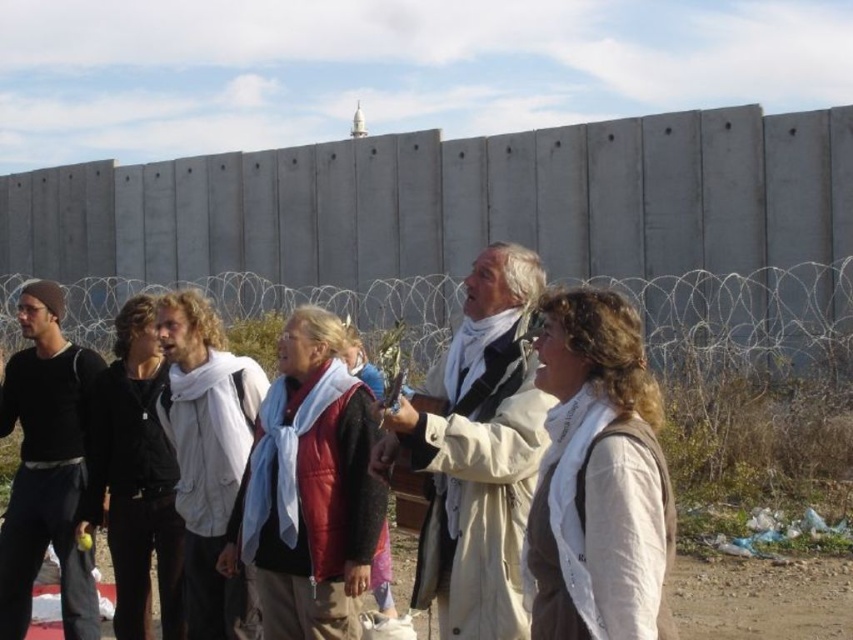
You are a photographer taking a picture of the scene. The concrete wall at upper center is blocking your view of the white wool scarf at center. Can you move the scarf to the front to make it visible in the photo?

The white wool scarf at center is behind the concrete wall at upper center, so moving it to the front would make it visible in the photo.

You are a photographer standing at a certain distance from the large concrete wall. You want to capture a photo of the point at coordinates point (x=71, y=266) on the wall. If your camera has a maximum focus range of 75 meters, will you need to move closer to ensure the point is in focus?

The distance of point (x=71, y=266) from the viewer is 80.48 meters, which exceeds the camera maximum focus range of 75 meters. Therefore, you need to move closer to ensure the point is in focus.

You are standing in front of the large concrete wall and see the white matte jacket at center. Based on the coordinates provided, is the jacket closer to the top or the bottom of the image?

The white matte jacket at center is located at point 0.706 on the x and 0.559 on the y. Since the y coordinate is 0.559, which is closer to 0.5 than 1, it is closer to the bottom of the image.